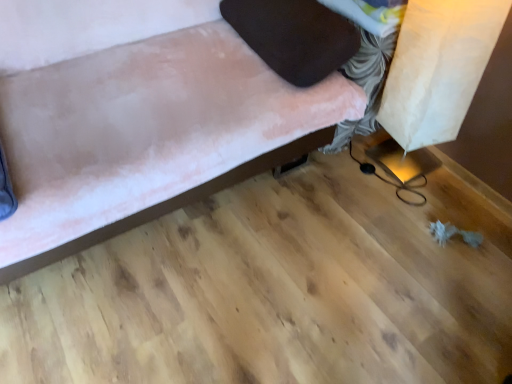
Question: From the image's perspective, is velvet brown pillow at upper right above or below velvet pink couch at upper left?

Choices:
 (A) below
 (B) above

Answer: (B)

Question: Based on their positions, is velvet brown pillow at upper right located to the left or right of velvet pink couch at upper left?

Choices:
 (A) right
 (B) left

Answer: (A)

Question: From a real-world perspective, relative to velvet pink couch at upper left, is velvet brown pillow at upper right vertically above or below?

Choices:
 (A) above
 (B) below

Answer: (A)

Question: From the image's perspective, is velvet pink couch at upper left located above or below velvet brown pillow at upper right?

Choices:
 (A) above
 (B) below

Answer: (B)

Question: From their relative heights in the image, would you say velvet pink couch at upper left is taller or shorter than velvet brown pillow at upper right?

Choices:
 (A) short
 (B) tall

Answer: (B)

Question: Considering the positions of velvet pink couch at upper left and velvet brown pillow at upper right in the image, is velvet pink couch at upper left bigger or smaller than velvet brown pillow at upper right?

Choices:
 (A) big
 (B) small

Answer: (A)

Question: Considering their positions, is velvet pink couch at upper left located in front of or behind velvet brown pillow at upper right?

Choices:
 (A) behind
 (B) front

Answer: (B)